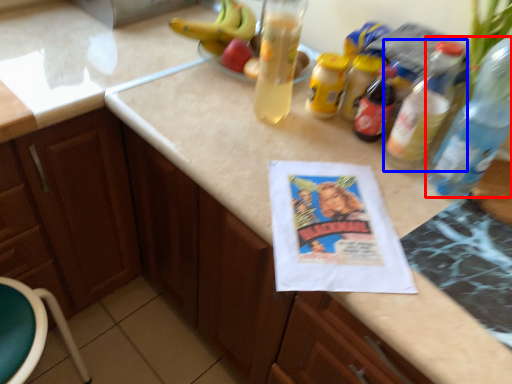
Question: Which point is further to the camera, bottle (highlighted by a red box) or bottle (highlighted by a blue box)?

Choices:
 (A) bottle
 (B) bottle

Answer: (B)